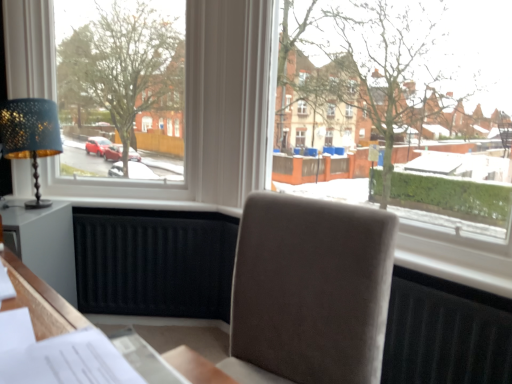
Question: Is white paper at lower left thinner than suede-like beige chair at center?

Choices:
 (A) yes
 (B) no

Answer: (A)

Question: Is white paper at lower left at the left side of suede-like beige chair at center?

Choices:
 (A) no
 (B) yes

Answer: (B)

Question: From a real-world perspective, is white paper at lower left on suede-like beige chair at center?

Choices:
 (A) yes
 (B) no

Answer: (A)

Question: Considering the relative sizes of white paper at lower left and suede-like beige chair at center in the image provided, is white paper at lower left smaller than suede-like beige chair at center?

Choices:
 (A) no
 (B) yes

Answer: (B)

Question: Is the position of white paper at lower left less distant than that of suede-like beige chair at center?

Choices:
 (A) no
 (B) yes

Answer: (B)

Question: Visually, is white wood table at lower left positioned to the left or to the right of suede-like beige chair at center?

Choices:
 (A) right
 (B) left

Answer: (B)

Question: From a real-world perspective, relative to suede-like beige chair at center, is white wood table at lower left vertically above or below?

Choices:
 (A) above
 (B) below

Answer: (B)

Question: From the image's perspective, relative to suede-like beige chair at center, is white wood table at lower left above or below?

Choices:
 (A) below
 (B) above

Answer: (B)

Question: Relative to suede-like beige chair at center, is white wood table at lower left in front or behind?

Choices:
 (A) behind
 (B) front

Answer: (A)

Question: Considering their positions, is suede-like beige chair at center located in front of or behind matte gold table lamp at left?

Choices:
 (A) behind
 (B) front

Answer: (B)

Question: Does point (310, 241) appear closer or farther from the camera than point (23, 140)?

Choices:
 (A) farther
 (B) closer

Answer: (B)

Question: From a real-world perspective, is suede-like beige chair at center physically located above or below matte gold table lamp at left?

Choices:
 (A) below
 (B) above

Answer: (A)

Question: Is suede-like beige chair at center situated inside matte gold table lamp at left or outside?

Choices:
 (A) inside
 (B) outside

Answer: (B)

Question: Would you say white plastic window at upper left, the 2th window positioned from the right, is to the left or to the right of transparent glass window at center, placed as the 1th window when sorted from right to left, in the picture?

Choices:
 (A) left
 (B) right

Answer: (A)

Question: From a real-world perspective, relative to transparent glass window at center, placed as the 1th window when sorted from right to left, is white plastic window at upper left, which is counted as the first window, starting from the left, vertically above or below?

Choices:
 (A) below
 (B) above

Answer: (B)